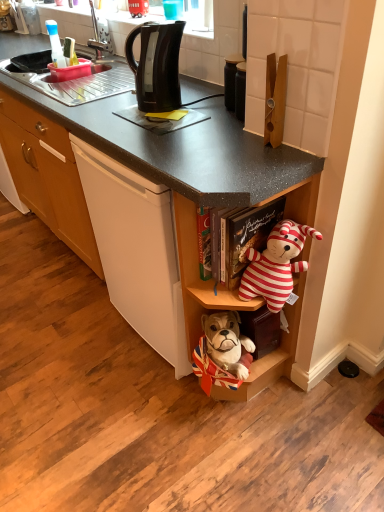
Question: Can you confirm if striped fabric teddy bear at center-right is bigger than wooden shelf at lower center?

Choices:
 (A) no
 (B) yes

Answer: (A)

Question: From a real-world perspective, does striped fabric teddy bear at center-right sit lower than wooden shelf at lower center?

Choices:
 (A) no
 (B) yes

Answer: (A)

Question: Is striped fabric teddy bear at center-right not close to wooden shelf at lower center?

Choices:
 (A) yes
 (B) no

Answer: (B)

Question: From a real-world perspective, is striped fabric teddy bear at center-right over wooden shelf at lower center?

Choices:
 (A) yes
 (B) no

Answer: (A)

Question: Does striped fabric teddy bear at center-right appear on the right side of wooden shelf at lower center?

Choices:
 (A) yes
 (B) no

Answer: (A)

Question: Is the position of striped fabric teddy bear at center-right more distant than that of wooden shelf at lower center?

Choices:
 (A) yes
 (B) no

Answer: (A)

Question: Can you confirm if wooden shelf at lower center is thinner than striped fabric teddy bear at center-right?

Choices:
 (A) no
 (B) yes

Answer: (A)

Question: Are wooden shelf at lower center and striped fabric teddy bear at center-right beside each other?

Choices:
 (A) no
 (B) yes

Answer: (A)

Question: Does wooden shelf at lower center have a larger size compared to striped fabric teddy bear at center-right?

Choices:
 (A) yes
 (B) no

Answer: (A)

Question: Does wooden shelf at lower center have a lesser height compared to striped fabric teddy bear at center-right?

Choices:
 (A) yes
 (B) no

Answer: (B)

Question: From the image's perspective, does wooden shelf at lower center appear lower than striped fabric teddy bear at center-right?

Choices:
 (A) no
 (B) yes

Answer: (B)

Question: Considering the relative positions of wooden shelf at lower center and striped fabric teddy bear at center-right in the image provided, is wooden shelf at lower center to the right of striped fabric teddy bear at center-right from the viewer's perspective?

Choices:
 (A) no
 (B) yes

Answer: (A)

Question: Is striped fabric teddy bear at center-right to the left of black plastic kettle at upper center from the viewer's perspective?

Choices:
 (A) no
 (B) yes

Answer: (A)